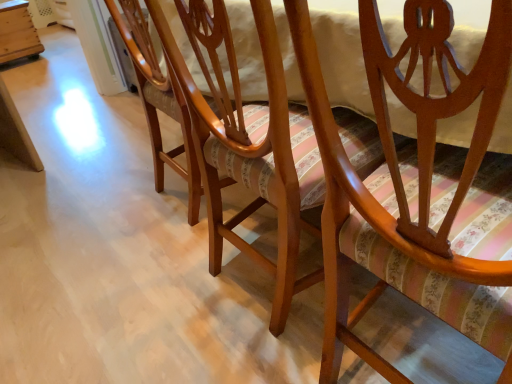
Question: Is matte wood chair at center, which is the 1th chair in right-to-left order, situated inside wooden crate at left or outside?

Choices:
 (A) inside
 (B) outside

Answer: (B)

Question: Does point (298, 59) appear closer or farther from the camera than point (24, 16)?

Choices:
 (A) closer
 (B) farther

Answer: (A)

Question: Which of these objects is positioned closest to the wooden crate at left?

Choices:
 (A) matte wood chair at center, which is the 1th chair in right-to-left order
 (B) wooden chair at center, the 2th chair positioned from the right

Answer: (B)

Question: Considering the real-world distances, which object is farthest from the wooden crate at left?

Choices:
 (A) wooden chair at center, positioned as the 1th chair in left-to-right order
 (B) matte wood chair at center, which is the 1th chair in right-to-left order

Answer: (B)